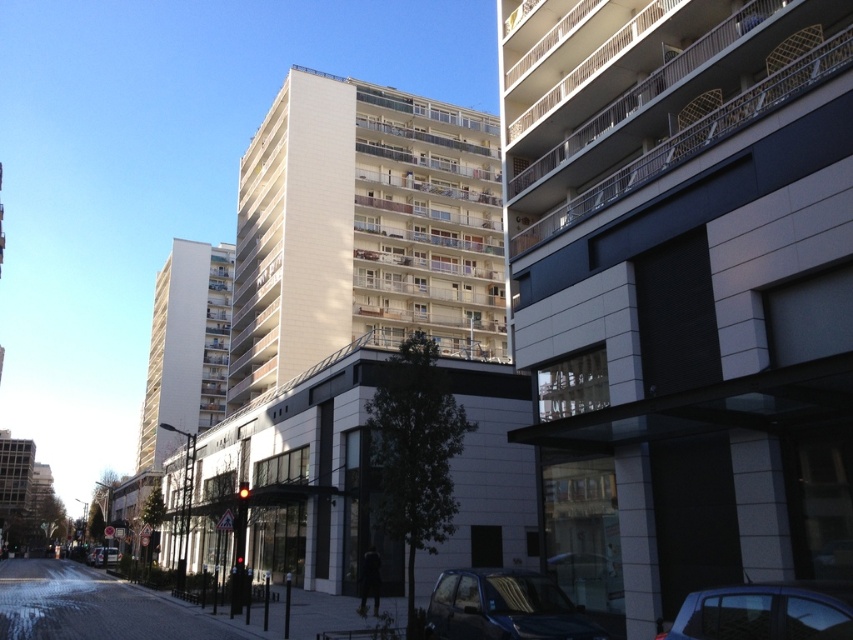
You are a delivery person needing to park your van between the metallic blue car at lower right and the metallic silver car at lower left. The van is 6 meters long. Can you fit it there?

The distance between the metallic blue car at lower right and the metallic silver car at lower left is 54.31 meters, so yes, the van can fit between them since the space is longer than the van.

You are a pedestrian standing on the sidewalk in front of the modern building. You see a shiny blue car at lower center and a metallic blue car at lower right. Which car is closer to the building?

The shiny blue car at lower center is closer to the building because it is positioned below the metallic blue car at lower right, indicating it is in a lower, more forward position relative to the building.

You are a pedestrian standing on the sidewalk and want to cross the street to reach the modern building with the covered walkway. Which car, the shiny blue car at lower center or the metallic silver car at lower left, is closer to the building you want to reach?

The shiny blue car at lower center is closer to the modern building with the covered walkway because it is positioned to the right of the metallic silver car at lower left, which would place it nearer to the building in the scene.